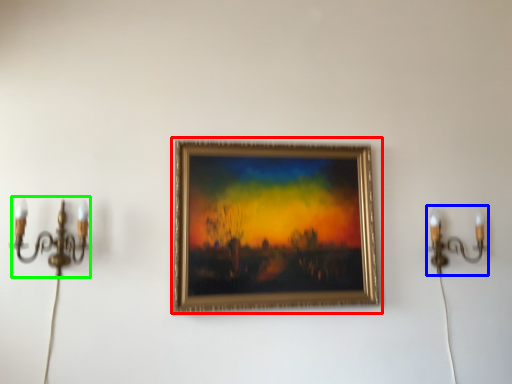
Question: Which object is the farthest from picture frame (highlighted by a red box)? Choose among these: candle holder (highlighted by a blue box) or candle holder (highlighted by a green box).

Choices:
 (A) candle holder
 (B) candle holder

Answer: (B)